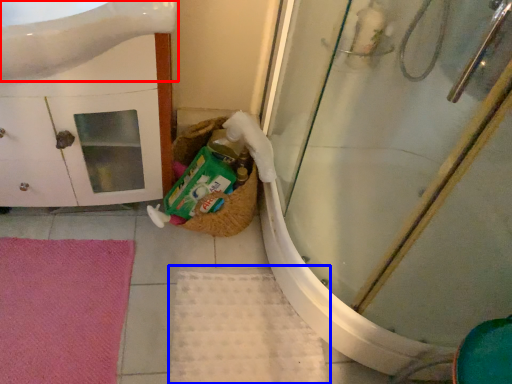
Question: Which object appears farthest to the camera in this image, sink (highlighted by a red box) or bath mat (highlighted by a blue box)?

Choices:
 (A) sink
 (B) bath mat

Answer: (B)